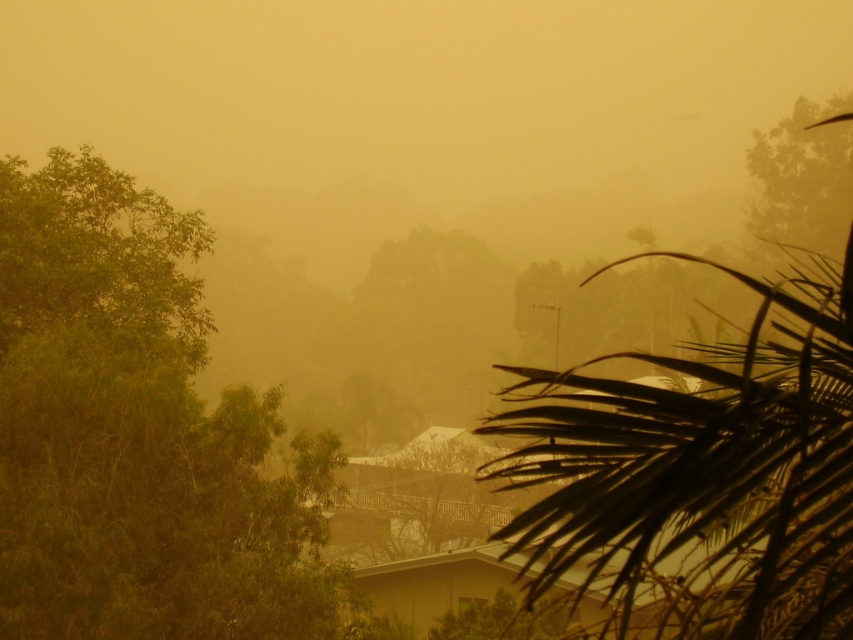
Based on the photo, is green leafy tree at left further to camera compared to dark green leafy palm tree at right?

Yes, green leafy tree at left is further from the viewer.

Is point (73, 372) positioned in front of point (843, 300)?

That is False.

Identify the location of green leafy tree at left. Image resolution: width=853 pixels, height=640 pixels. (137, 435).